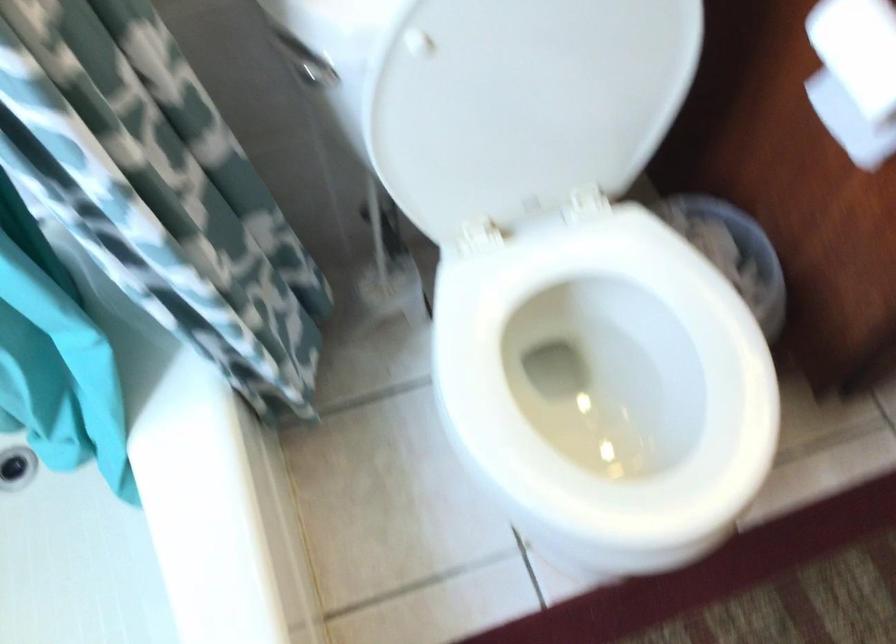
Image resolution: width=896 pixels, height=644 pixels. What do you see at coordinates (606, 375) in the screenshot?
I see `a white toilet seat` at bounding box center [606, 375].